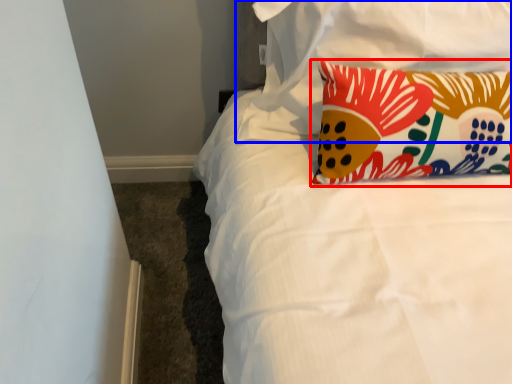
Question: Which object appears closest to the camera in this image, pillow (highlighted by a red box) or pillow (highlighted by a blue box)?

Choices:
 (A) pillow
 (B) pillow

Answer: (A)